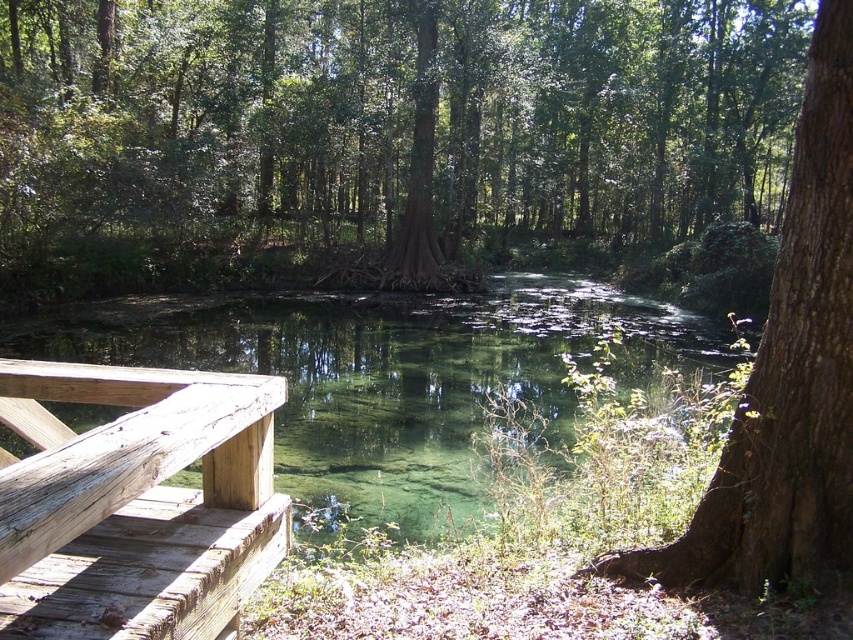
Is clear water stream at center thinner than weathered wood at left?

Incorrect, clear water stream at center's width is not less than weathered wood at left's.

Between clear water stream at center and weathered wood at left, which one has more height?

clear water stream at center is taller.

Find the location of a particular element. The width and height of the screenshot is (853, 640). clear water stream at center is located at coordinates (392, 374).

Consider the image. Which of these two, weathered wood at left or brown rough bark tree at right, stands shorter?

weathered wood at left

Does weathered wood at left appear on the right side of brown rough bark tree at right?

No, weathered wood at left is not to the right of brown rough bark tree at right.

Measure the distance between weathered wood at left and camera.

They are 1.08 meters apart.

Find the location of a particular element. Image resolution: width=853 pixels, height=640 pixels. weathered wood at left is located at coordinates click(136, 502).

Does green matte tree at center have a lesser height compared to clear water stream at center?

No, green matte tree at center is not shorter than clear water stream at center.

Can you confirm if green matte tree at center is positioned above clear water stream at center?

Yes, green matte tree at center is above clear water stream at center.

The image size is (853, 640). What do you see at coordinates (389, 120) in the screenshot? I see `green matte tree at center` at bounding box center [389, 120].

Identify the location of green matte tree at center. The width and height of the screenshot is (853, 640). (389, 120).